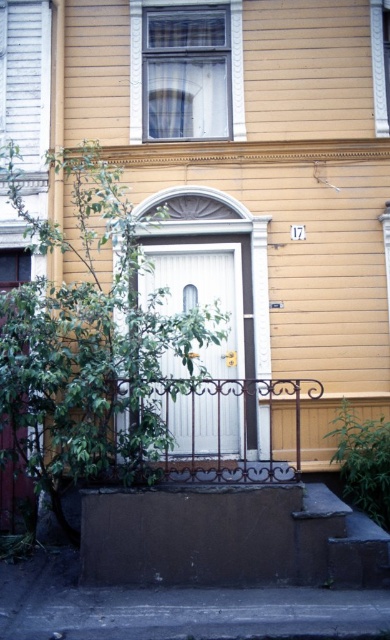
Question: Which object appears farthest from the camera in this image?

Choices:
 (A) brown concrete stair at lower center
 (B) white wood door at center

Answer: (B)

Question: Can you confirm if brown concrete stair at lower center is wider than white wood door at center?

Choices:
 (A) yes
 (B) no

Answer: (A)

Question: Is brown concrete stair at lower center to the right of white wood door at center from the viewer's perspective?

Choices:
 (A) yes
 (B) no

Answer: (B)

Question: Which point is closer to the camera taking this photo?

Choices:
 (A) (209, 400)
 (B) (168, 637)

Answer: (B)

Question: Can you confirm if brown concrete stair at lower center is thinner than white wood door at center?

Choices:
 (A) yes
 (B) no

Answer: (B)